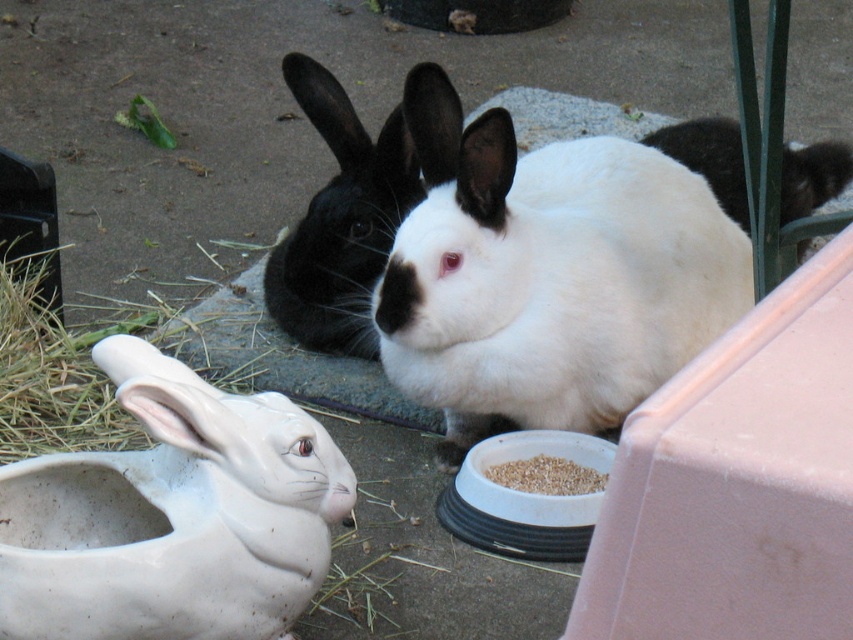
You are a gardener who wants to place a small decorative stone between the black matte rabbit at center and the brown grain at lower center. Based on their widths, can you determine if there will be enough space for the stone?

The black matte rabbit at center might be wider than brown grain at lower center, so there may not be enough space for the stone between them.

You are a photographer aiming to capture the white soft fur rabbit at center and the brown grain at lower center in a single shot. Since you want both subjects to be in focus, which one should you focus on first to ensure the other remains sharp?

You should focus on the white soft fur rabbit at center first because it is closer to the viewer than the brown grain at lower center, ensuring the grain will be in focus as well.

You are a gardener who wants to place a new flower pot on the gravel near the white fur at center. According to the scene, is the white matte ceramic rabbit at lower left blocking the spot where you want to put the flower pot?

The white matte ceramic rabbit at lower left is positioned under the white fur at center, so it is blocking the spot where you want to place the flower pot.